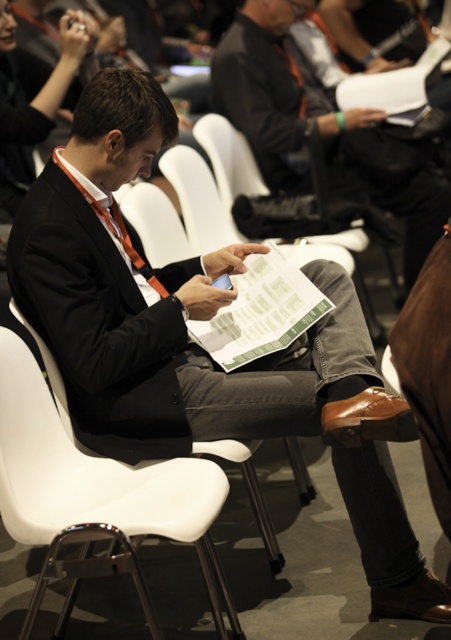
Which of these two, white plastic chair at center or matte black suit at center, stands shorter?

white plastic chair at center

Is white plastic chair at center above matte black suit at center?

Actually, white plastic chair at center is below matte black suit at center.

Which is behind, point (9, 525) or point (334, 161)?

The point (334, 161) is more distant.

The height and width of the screenshot is (640, 451). I want to click on white plastic chair at center, so click(x=96, y=492).